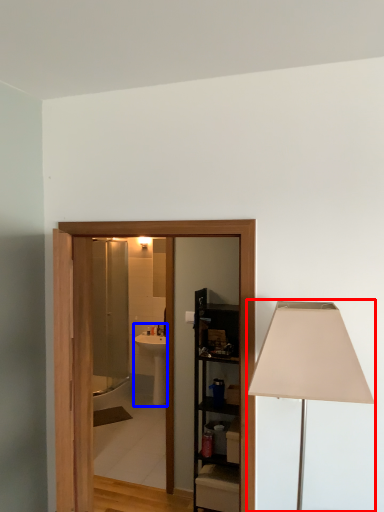
Question: Among these objects, which one is nearest to the camera, lamp (highlighted by a red box) or sink (highlighted by a blue box)?

Choices:
 (A) lamp
 (B) sink

Answer: (A)